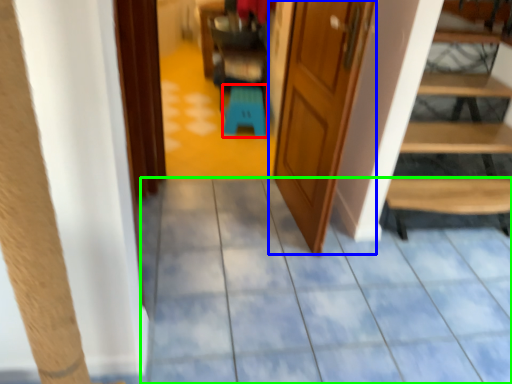
Question: Considering the real-world distances, which object is farthest from stool (highlighted by a red box)? door (highlighted by a blue box) or path (highlighted by a green box)?

Choices:
 (A) door
 (B) path

Answer: (B)